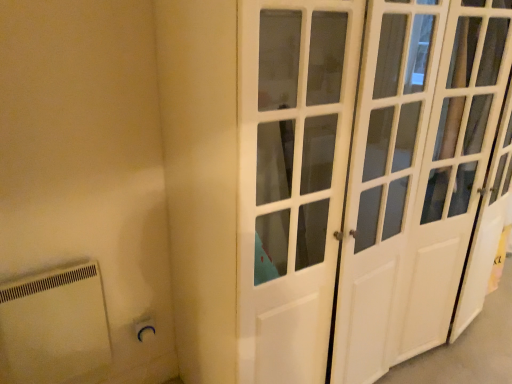
Question: Is white plastic electric outlet at lower left bigger or smaller than white glossy door at center?

Choices:
 (A) big
 (B) small

Answer: (B)

Question: In terms of height, does white plastic electric outlet at lower left look taller or shorter compared to white glossy door at center?

Choices:
 (A) tall
 (B) short

Answer: (B)

Question: Which of these objects is positioned farthest from the white plastic electric outlet at lower left?

Choices:
 (A) white plastic radiator at lower left
 (B) white glossy door at center

Answer: (B)

Question: Which is farther from the white glossy door at center?

Choices:
 (A) white plastic electric outlet at lower left
 (B) white plastic radiator at lower left

Answer: (A)